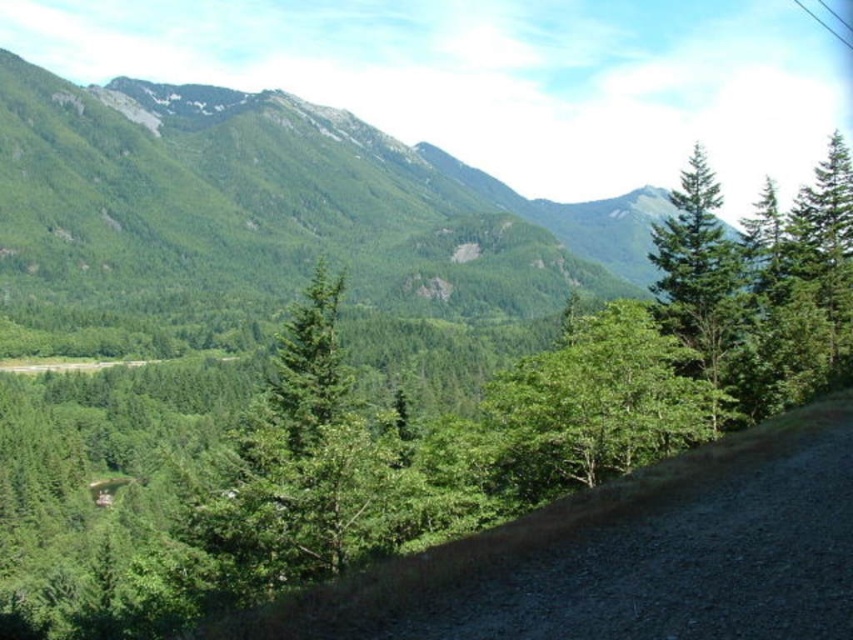
Is green forested mountain at upper center behind dirt/gravel path at lower right?

Yes.

Between point (338, 163) and point (416, 563), which one is positioned in front?

Point (416, 563) is more forward.

Which is in front, point (415, 211) or point (755, 461)?

Point (755, 461) is more forward.

The height and width of the screenshot is (640, 853). I want to click on green forested mountain at upper center, so click(x=274, y=202).

Between green forested mountain at upper center and green leafy tree at center, which one has more height?

green forested mountain at upper center is taller.

Does green forested mountain at upper center appear on the left side of green leafy tree at center?

Correct, you'll find green forested mountain at upper center to the left of green leafy tree at center.

Measure the distance between point (578, 228) and camera.

Point (578, 228) and camera are 534.64 meters apart.

This screenshot has width=853, height=640. Identify the location of green forested mountain at upper center. click(x=274, y=202).

Is dirt/gravel path at lower right closer to the viewer compared to green matte tree at upper right?

Yes, it is.

In the scene shown: Between dirt/gravel path at lower right and green matte tree at upper right, which one appears on the right side from the viewer's perspective?

green matte tree at upper right is more to the right.

Locate an element on the screen. dirt/gravel path at lower right is located at coordinates (515, 538).

Identify the location of dirt/gravel path at lower right. The image size is (853, 640). (515, 538).